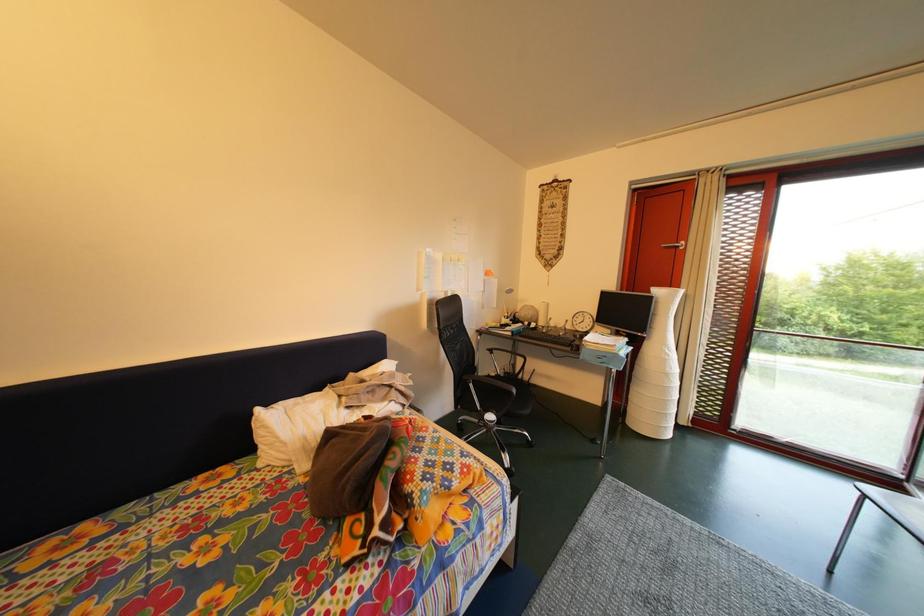
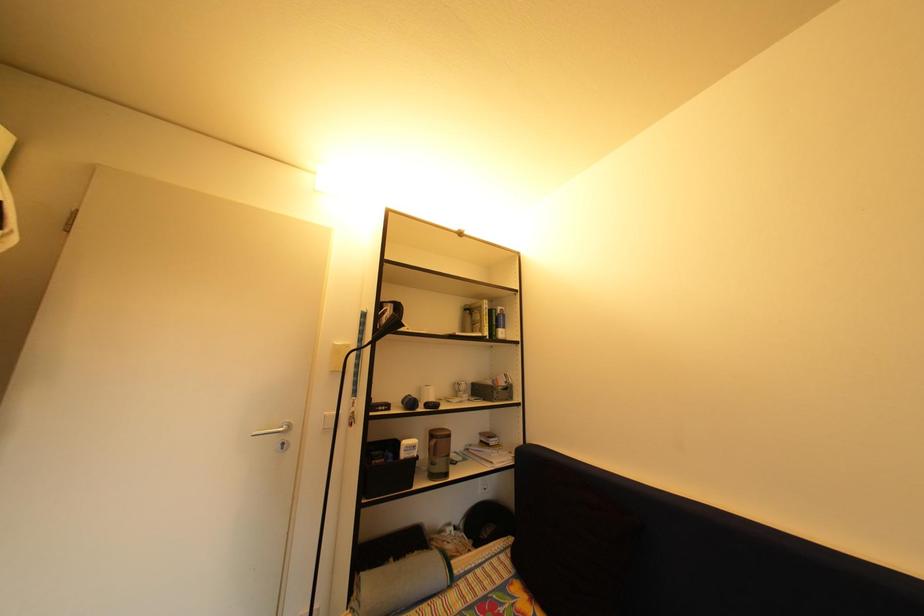
Question: The camera is either moving clockwise (left) or counter-clockwise (right) around the object. The first image is from the beginning of the video and the second image is from the end. Is the camera moving left or right when shooting the video?

Choices:
 (A) Left
 (B) Right

Answer: (B)